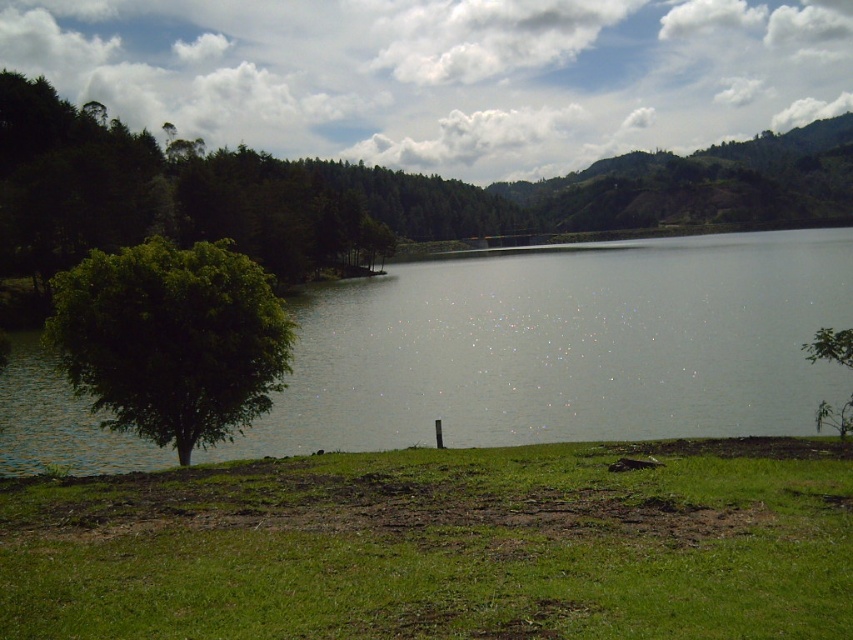
You are a hiker standing at the edge of the green grassy at lower center and want to reach the green leafy tree at lower right. Which direction should you move to get there?

To reach the green leafy tree at lower right from the green grassy at lower center, you should move upward since the green grassy at lower center is below the green leafy tree at lower right.

Based on the photo, you are standing at the point marked by the coordinates point (440, 545) in the image. Looking around, what do you see immediately in front of you?

The point (440, 545) marks green grassy at lower center, so you would see green grassy at lower center directly in front of you.